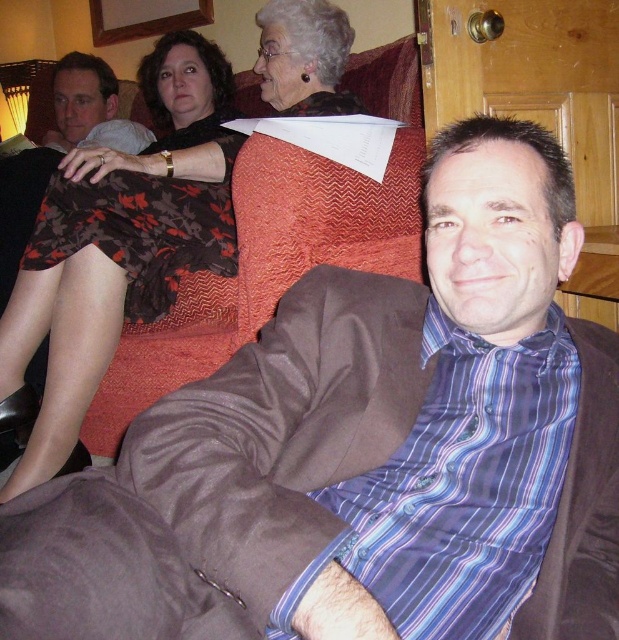
Is printed fabric dress at upper left thinner than matte black skirt at upper left?

No, printed fabric dress at upper left is not thinner than matte black skirt at upper left.

Does printed fabric dress at upper left have a greater width compared to matte black skirt at upper left?

Indeed, printed fabric dress at upper left has a greater width compared to matte black skirt at upper left.

What do you see at coordinates (106, 276) in the screenshot?
I see `printed fabric dress at upper left` at bounding box center [106, 276].

This screenshot has width=619, height=640. What are the coordinates of `printed fabric dress at upper left` in the screenshot? It's located at (106, 276).